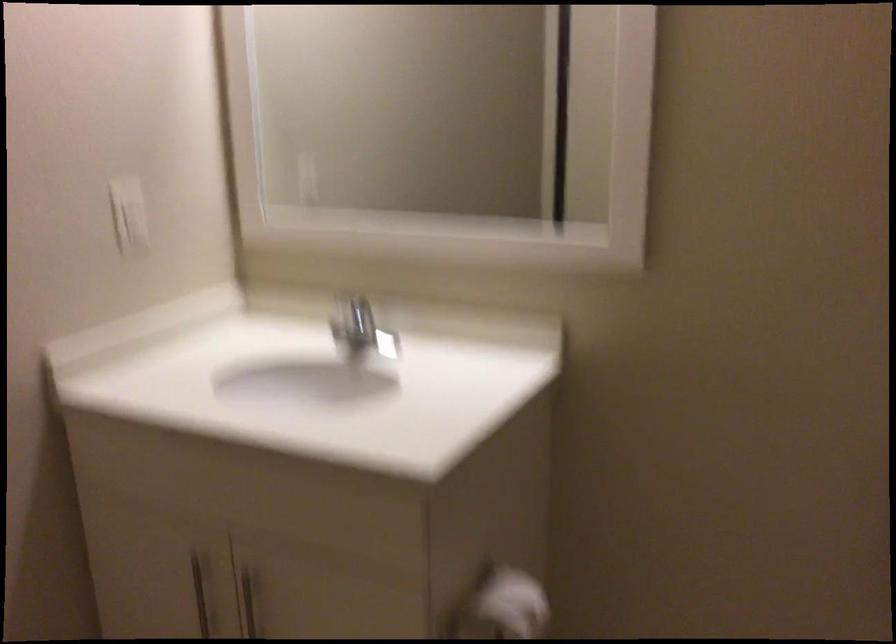
The location [511,603] corresponds to which object?

This point indicates the toilet paper roll.